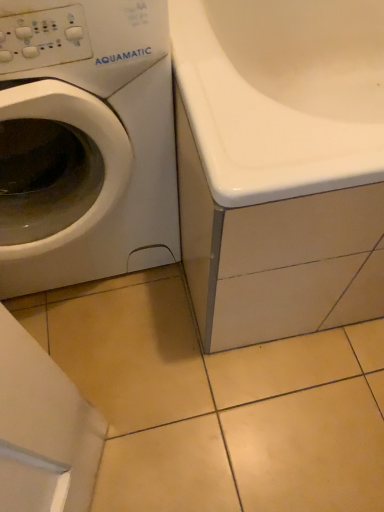
Locate an element on the screen. white glossy bathtub at center is located at coordinates (280, 164).

Describe the element at coordinates (280, 164) in the screenshot. I see `white glossy bathtub at center` at that location.

What do you see at coordinates (85, 142) in the screenshot?
I see `white matte washing machine at left` at bounding box center [85, 142].

Locate an element on the screen. This screenshot has height=512, width=384. white matte washing machine at left is located at coordinates (85, 142).

Where is `white glossy bathtub at center`? white glossy bathtub at center is located at coordinates (280, 164).

Which is more to the left, white matte washing machine at left or white glossy bathtub at center?

From the viewer's perspective, white matte washing machine at left appears more on the left side.

Which is behind, white matte washing machine at left or white glossy bathtub at center?

Positioned behind is white glossy bathtub at center.

Does point (117, 144) lie behind point (289, 139)?

That is True.

From the image's perspective, who appears lower, white matte washing machine at left or white glossy bathtub at center?

white matte washing machine at left is shown below in the image.

From a real-world perspective, is white matte washing machine at left positioned over white glossy bathtub at center based on gravity?

Indeed, from a real-world perspective, white matte washing machine at left stands above white glossy bathtub at center.

Can you confirm if white matte washing machine at left is thinner than white glossy bathtub at center?

Correct, the width of white matte washing machine at left is less than that of white glossy bathtub at center.

Can you confirm if white matte washing machine at left is taller than white glossy bathtub at center?

Yes, white matte washing machine at left is taller than white glossy bathtub at center.

Is white matte washing machine at left smaller than white glossy bathtub at center?

Yes.

Is white matte washing machine at left inside the boundaries of white glossy bathtub at center, or outside?

white matte washing machine at left is not inside white glossy bathtub at center, it's outside.

From the picture: Are white matte washing machine at left and white glossy bathtub at center located far from each other?

No.

Is white matte washing machine at left facing towards white glossy bathtub at center?

No, white matte washing machine at left is not aimed at white glossy bathtub at center.

Can you tell me how much white matte washing machine at left and white glossy bathtub at center differ in facing direction?

The angle between the facing direction of white matte washing machine at left and the facing direction of white glossy bathtub at center is 0.00103 degrees.

Consider the image. How distant is white matte washing machine at left from white glossy bathtub at center?

white matte washing machine at left is 25.08 centimeters away from white glossy bathtub at center.

This screenshot has width=384, height=512. Find the location of `washing machine on the left of white glossy bathtub at center`. washing machine on the left of white glossy bathtub at center is located at coordinates (85, 142).

Is white glossy bathtub at center at the left side of white matte washing machine at left?

No.

Who is more distant, white glossy bathtub at center or white matte washing machine at left?

white glossy bathtub at center is further from the camera.

Consider the image. Which point is more forward, (347, 6) or (60, 221)?

The point (60, 221) is closer to the camera.

From the image's perspective, is white glossy bathtub at center located beneath white matte washing machine at left?

Incorrect, from the image's perspective, white glossy bathtub at center is higher than white matte washing machine at left.

From a real-world perspective, is white glossy bathtub at center positioned over white matte washing machine at left based on gravity?

Actually, white glossy bathtub at center is physically below white matte washing machine at left in the real world.

Considering the sizes of objects white glossy bathtub at center and white matte washing machine at left in the image provided, who is wider, white glossy bathtub at center or white matte washing machine at left?

Wider between the two is white glossy bathtub at center.

Does white glossy bathtub at center have a lesser height compared to white matte washing machine at left?

Correct, white glossy bathtub at center is not as tall as white matte washing machine at left.

Between white glossy bathtub at center and white matte washing machine at left, which one has smaller size?

Smaller between the two is white matte washing machine at left.

Is white matte washing machine at left surrounded by white glossy bathtub at center?

No, white matte washing machine at left is located outside of white glossy bathtub at center.

Is white glossy bathtub at center far from white matte washing machine at left?

That's not correct — white glossy bathtub at center is a little close to white matte washing machine at left.

Is white glossy bathtub at center aimed at white matte washing machine at left?

No, white glossy bathtub at center is not aimed at white matte washing machine at left.

Find the location of a particular element. bath above the white matte washing machine at left (from the image's perspective) is located at coordinates (280, 164).

The height and width of the screenshot is (512, 384). Find the location of `bath above the white matte washing machine at left (from the image's perspective)`. bath above the white matte washing machine at left (from the image's perspective) is located at coordinates (280, 164).

Image resolution: width=384 pixels, height=512 pixels. What are the coordinates of `washing machine lying in front of the white glossy bathtub at center` in the screenshot? It's located at (85, 142).